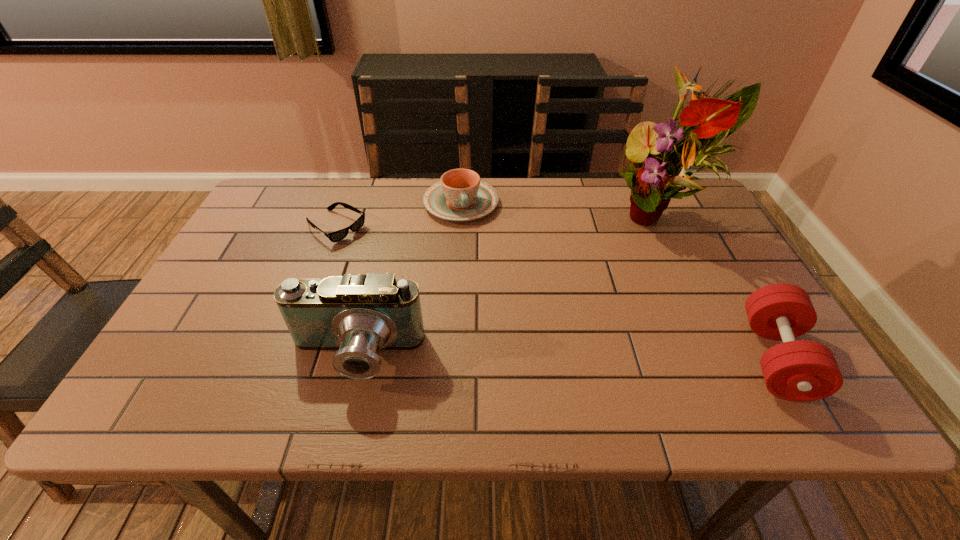
The height and width of the screenshot is (540, 960). Find the location of `vacant point located between the tallest object and the second shortest object`. vacant point located between the tallest object and the second shortest object is located at coordinates (562, 210).

This screenshot has width=960, height=540. Find the location of `free space that is in between the bouquet and the fourth tallest object`. free space that is in between the bouquet and the fourth tallest object is located at coordinates (562, 210).

Find the location of a particular element. vacant area between the third tallest object and the tallest object is located at coordinates (719, 287).

Locate an element on the screen. Image resolution: width=960 pixels, height=540 pixels. object that is the closest to the fourth shortest object is located at coordinates (339, 235).

The height and width of the screenshot is (540, 960). I want to click on the third closest object relative to the bouquet, so click(x=358, y=315).

Locate an element on the screen. Image resolution: width=960 pixels, height=540 pixels. free space in the image that satisfies the following two spatial constraints: 1. on the front-facing side of the dumbbell; 2. on the left side of the second tallest object is located at coordinates (355, 358).

What are the coordinates of `vacant space that satisfies the following two spatial constraints: 1. on the front side of the fourth tallest object; 2. on the right side of the bouquet` in the screenshot? It's located at (461, 217).

This screenshot has height=540, width=960. What are the coordinates of `vacant space that satisfies the following two spatial constraints: 1. on the front side of the bouquet; 2. on the left side of the third tallest object` in the screenshot? It's located at (732, 358).

The image size is (960, 540). Find the location of `vacant space that satisfies the following two spatial constraints: 1. on the front-facing side of the third shortest object; 2. on the left side of the camcorder`. vacant space that satisfies the following two spatial constraints: 1. on the front-facing side of the third shortest object; 2. on the left side of the camcorder is located at coordinates (355, 358).